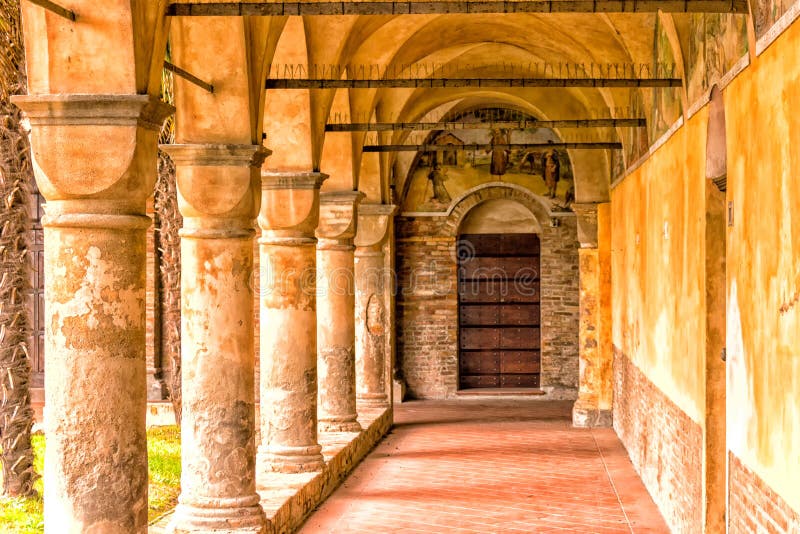
This screenshot has height=534, width=800. Find the location of `support beam`. support beam is located at coordinates (460, 84), (477, 7), (482, 117), (477, 144).